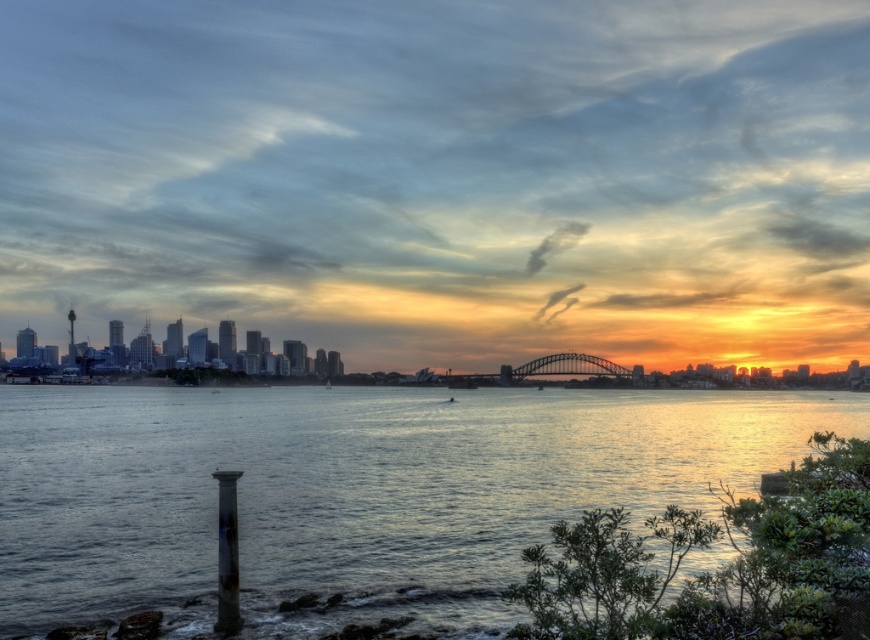
Question: Which of the following is the farthest from the observer?

Choices:
 (A) smooth water at center
 (B) metallic steel bridge at center

Answer: (B)

Question: Does smooth water at center appear under metallic steel bridge at center?

Choices:
 (A) no
 (B) yes

Answer: (B)

Question: Does smooth water at center have a greater width compared to metallic steel bridge at center?

Choices:
 (A) no
 (B) yes

Answer: (B)

Question: Considering the relative positions of smooth water at center and metallic steel bridge at center in the image provided, where is smooth water at center located with respect to metallic steel bridge at center?

Choices:
 (A) left
 (B) right

Answer: (A)